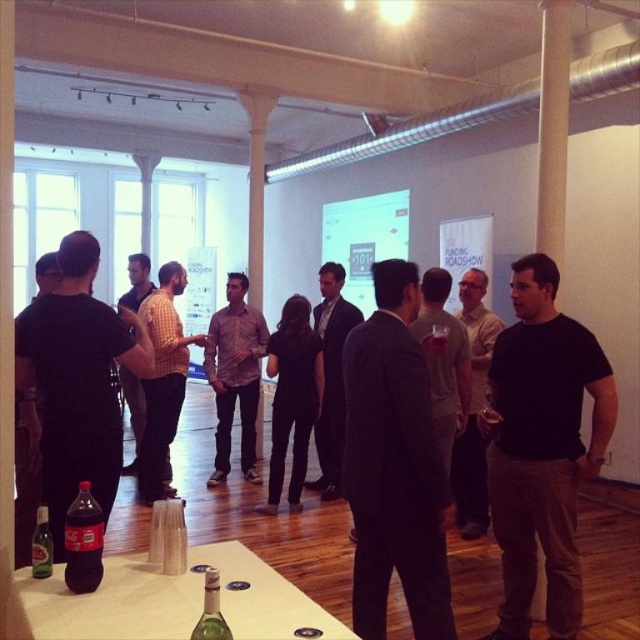
Question: Does plaid shirt at center have a lesser width compared to checkered shirt at center?

Choices:
 (A) yes
 (B) no

Answer: (A)

Question: Considering the real-world distances, which object is farthest from the checkered shirt at center?

Choices:
 (A) black matte shirt at center
 (B) plaid shirt at center
 (C) green glass bottle at lower center

Answer: (C)

Question: Does plaid shirt at center appear on the left side of checkered shirt at center?

Choices:
 (A) yes
 (B) no

Answer: (B)

Question: Based on their relative distances, which object is farther from the dark brown glass coca-cola bottle at lower left?

Choices:
 (A) green glass bottle at lower left
 (B) checkered shirt at center
 (C) plaid shirt at center

Answer: (C)

Question: Observing the image, what is the correct spatial positioning of checkered shirt at center in reference to green glass bottle at lower center?

Choices:
 (A) left
 (B) right

Answer: (A)

Question: Which is nearer to the plaid shirt at center?

Choices:
 (A) black matte shirt at center
 (B) dark brown glass coca-cola bottle at lower left
 (C) checkered shirt at center

Answer: (C)